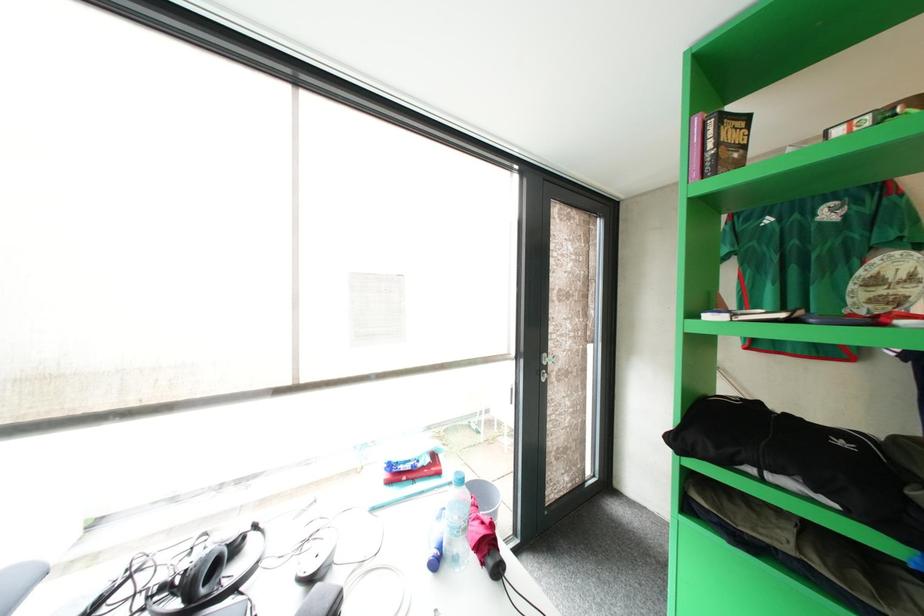
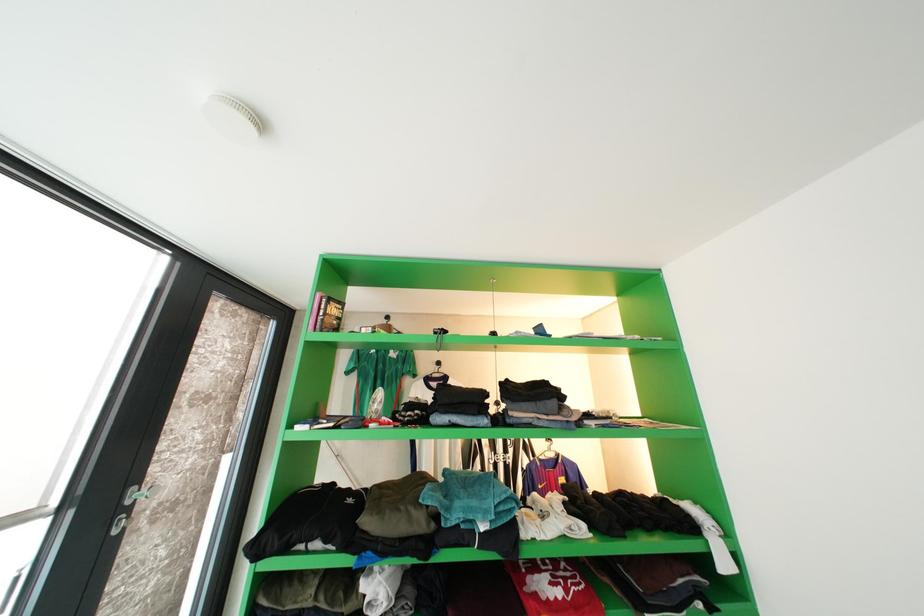
Based on the continuous images, in which direction is the camera rotating?

The camera rotated toward right-up.